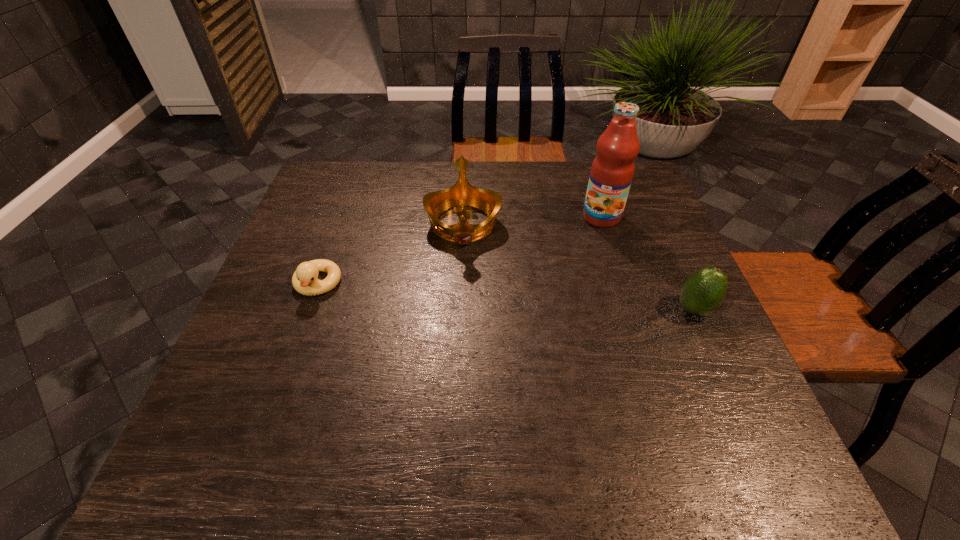
I want to click on vacant space in between the tallest object and the avocado, so click(x=648, y=264).

The height and width of the screenshot is (540, 960). In order to click on free spot between the duckling and the tiara in this screenshot , I will do `click(391, 254)`.

Locate an element on the screen. The width and height of the screenshot is (960, 540). free spot between the shortest object and the third object from left to right is located at coordinates (460, 251).

You are a GUI agent. You are given a task and a screenshot of the screen. Output one action in this format:
    pyautogui.click(x=<x>, y=<y>)
    Task: Click on the free point between the tallest object and the rightmost object
    The height and width of the screenshot is (540, 960).
    Given the screenshot: What is the action you would take?
    pyautogui.click(x=648, y=264)

The height and width of the screenshot is (540, 960). What are the coordinates of `unoccupied area between the third object from left to right and the tiara` in the screenshot? It's located at (533, 220).

Where is `vacant region between the tallest object and the tiara`? Image resolution: width=960 pixels, height=540 pixels. vacant region between the tallest object and the tiara is located at coordinates coord(533,220).

Where is `free space between the leftmost object and the rightmost object`? free space between the leftmost object and the rightmost object is located at coordinates (506, 297).

Locate which object ranks second in proximity to the leftmost object. Please provide its 2D coordinates. Your answer should be formatted as a tuple, i.e. [(x, y)], where the tuple contains the x and y coordinates of a point satisfying the conditions above.

[(612, 170)]

Point out which object is positioned as the nearest to the rightmost object. Please provide its 2D coordinates. Your answer should be formatted as a tuple, i.e. [(x, y)], where the tuple contains the x and y coordinates of a point satisfying the conditions above.

[(612, 170)]

Find the location of a particular element. The height and width of the screenshot is (540, 960). vacant space that satisfies the following two spatial constraints: 1. at the beak of the avocado; 2. on the left side of the leftmost object is located at coordinates (308, 310).